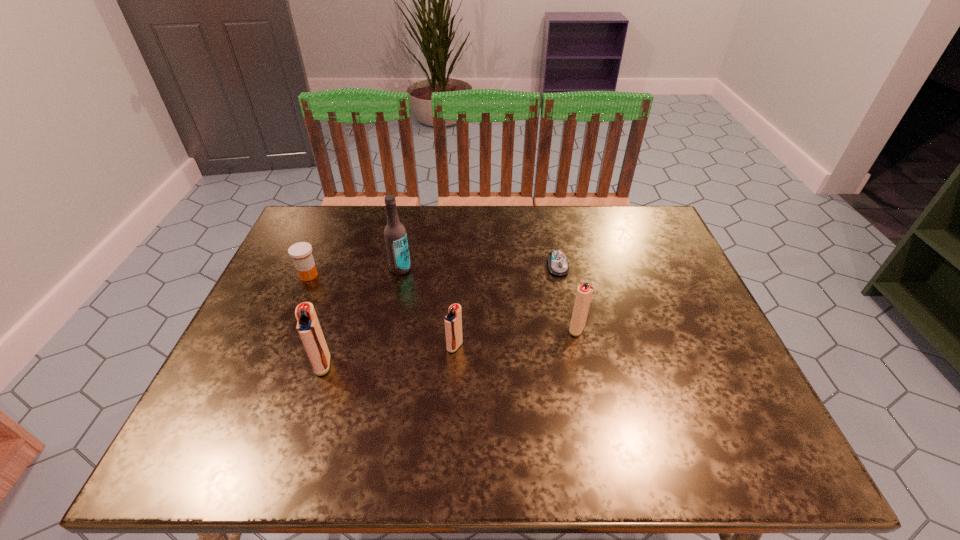
This screenshot has width=960, height=540. Identify the location of the fifth object from right to left. (308, 327).

This screenshot has width=960, height=540. Find the location of `the third object from right to left`. the third object from right to left is located at coordinates (453, 320).

Identify the location of the shortest igniter. Image resolution: width=960 pixels, height=540 pixels. (453, 320).

In order to click on the fourth farthest object in this screenshot , I will do `click(584, 293)`.

At what (x,y) coordinates should I click in order to perform the action: click on the fourth shortest object. Please return your answer as a coordinate pair (x, y). Looking at the image, I should click on (584, 293).

Locate an element on the screen. the tallest object is located at coordinates (395, 235).

Image resolution: width=960 pixels, height=540 pixels. Identify the location of beer bottle. (395, 235).

Identify the location of computer mouse. The width and height of the screenshot is (960, 540). (558, 264).

This screenshot has width=960, height=540. What are the coordinates of `the leftmost object` in the screenshot? It's located at (301, 252).

Locate an element on the screen. The image size is (960, 540). medicine is located at coordinates (301, 252).